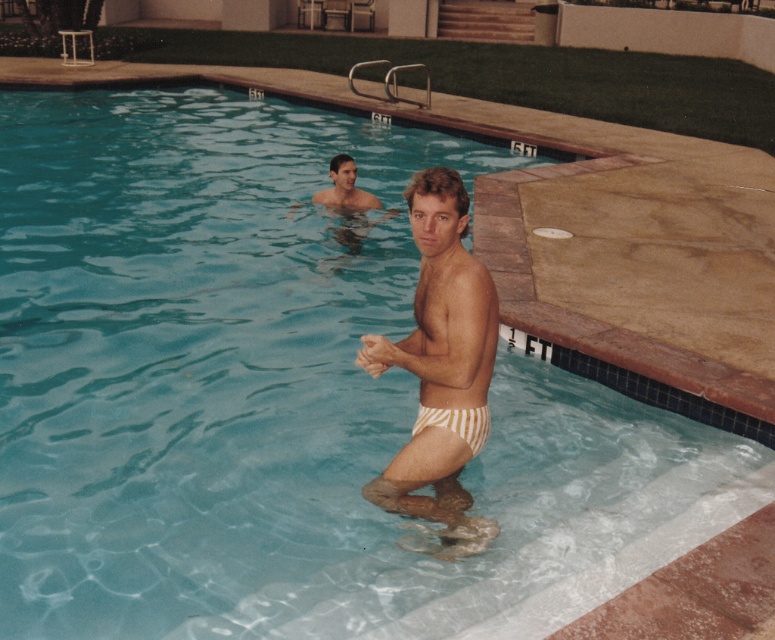
Question: Is white striped swimsuit at center thinner than white striped fabric at lower center?

Choices:
 (A) no
 (B) yes

Answer: (A)

Question: Which point is farther to the camera?

Choices:
 (A) white striped swimsuit at center
 (B) white striped fabric at lower center

Answer: (B)

Question: Is the position of white striped swimsuit at center more distant than that of white striped fabric at lower center?

Choices:
 (A) no
 (B) yes

Answer: (A)

Question: Among these points, which one is nearest to the camera?

Choices:
 (A) (472, 442)
 (B) (460, 186)

Answer: (B)

Question: Does white striped swimsuit at center lie in front of white striped fabric at lower center?

Choices:
 (A) no
 (B) yes

Answer: (B)

Question: Which object is farther from the camera taking this photo?

Choices:
 (A) white striped fabric at lower center
 (B) white striped swimsuit at center

Answer: (A)